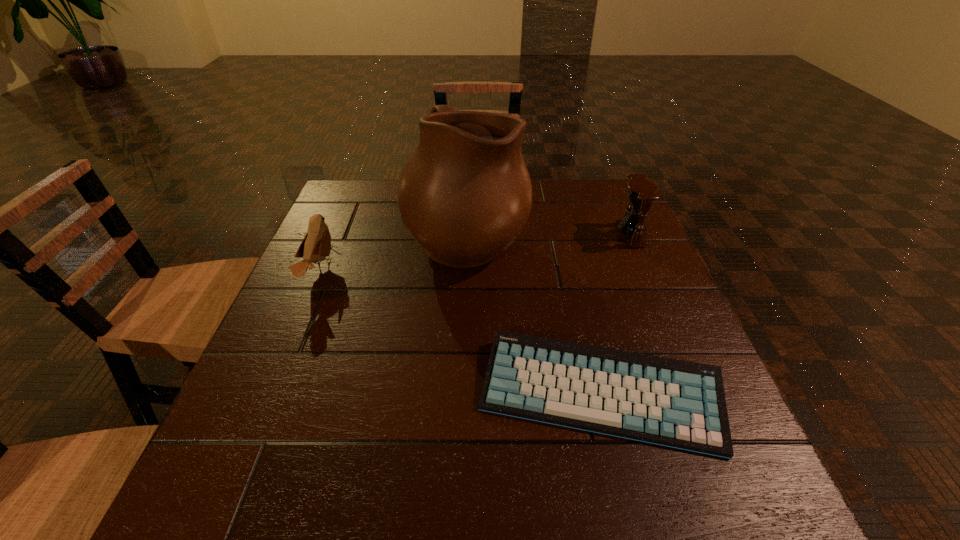
Identify the location of vacant space that is in between the computer keyboard and the hourglass. (615, 314).

Find the location of a particular element. This screenshot has width=960, height=540. object that is the third closest to the hourglass is located at coordinates click(x=316, y=246).

Image resolution: width=960 pixels, height=540 pixels. In order to click on object identified as the second closest to the hourglass in this screenshot , I will do `click(681, 404)`.

Find the location of a particular element. The width and height of the screenshot is (960, 540). free space that satisfies the following two spatial constraints: 1. on the back side of the hourglass; 2. on the left side of the nearest object is located at coordinates (562, 235).

Locate an element on the screen. This screenshot has height=540, width=960. free region that satisfies the following two spatial constraints: 1. at the beak of the shortest object; 2. on the right side of the leftmost object is located at coordinates (268, 394).

Identify the location of free space that satisfies the following two spatial constraints: 1. at the spout of the shortest object; 2. on the right side of the tallest object. (461, 394).

Locate an element on the screen. free space in the image that satisfies the following two spatial constraints: 1. on the back side of the nearest object; 2. at the spout of the cream pitcher is located at coordinates (563, 237).

This screenshot has height=540, width=960. Find the location of `free spot that satisfies the following two spatial constraints: 1. at the spout of the cream pitcher; 2. on the back side of the shortest object`. free spot that satisfies the following two spatial constraints: 1. at the spout of the cream pitcher; 2. on the back side of the shortest object is located at coordinates (461, 394).

Identify the location of blank space that satisfies the following two spatial constraints: 1. at the spout of the cream pitcher; 2. on the back side of the computer keyboard. This screenshot has height=540, width=960. (461, 394).

The height and width of the screenshot is (540, 960). I want to click on free space in the image that satisfies the following two spatial constraints: 1. at the beak of the nearest object; 2. on the right side of the leftmost object, so click(x=268, y=394).